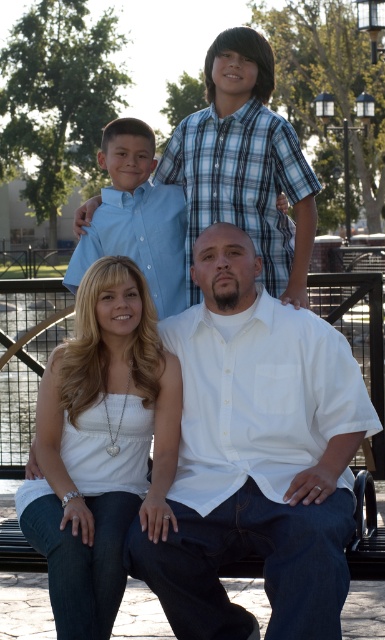
Who is more forward, (334, 432) or (140, 380)?

Positioned in front is point (334, 432).

Consider the image. Between white cotton shirt at center and white matte tank top at center, which one is positioned higher?

white cotton shirt at center

Locate an element on the screen. The image size is (385, 640). white cotton shirt at center is located at coordinates (257, 456).

Identify the location of white cotton shirt at center. This screenshot has height=640, width=385. (257, 456).